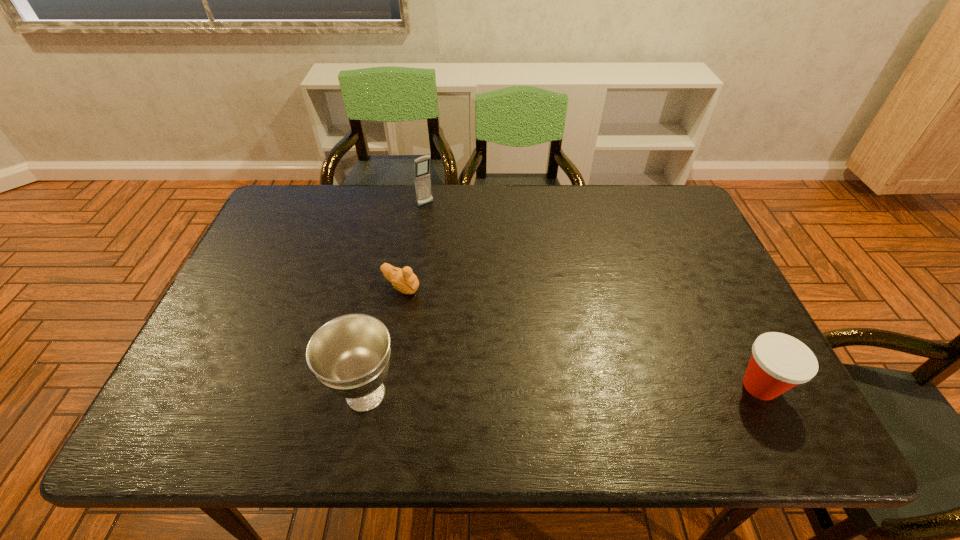
Image resolution: width=960 pixels, height=540 pixels. I want to click on free spot on the desktop that is between the chalice and the Dixie cup and is positioned on the face of the shortest object, so click(585, 390).

The width and height of the screenshot is (960, 540). I want to click on free space on the desktop that is between the chalice and the rightmost object and is positioned on the front-facing side of the cellular telephone, so click(589, 389).